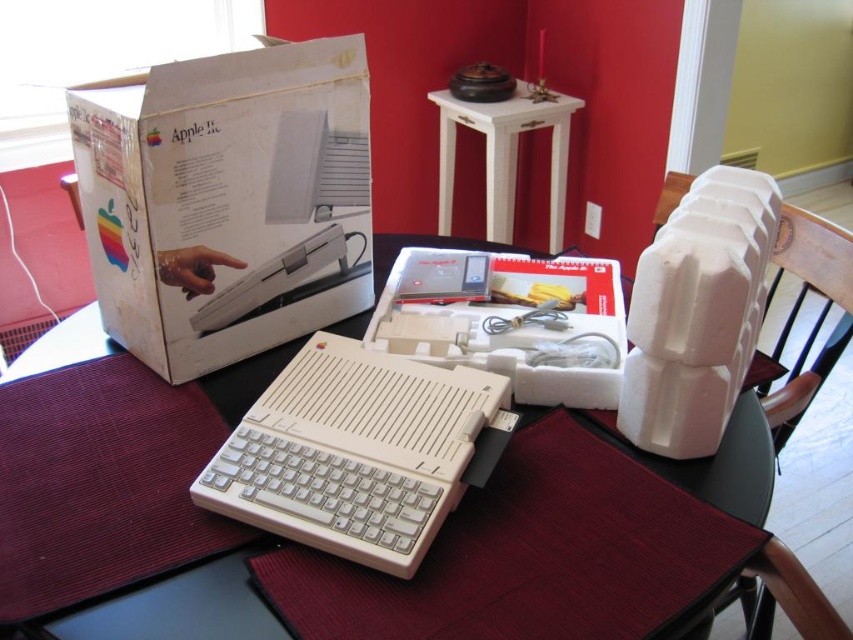
Question: From the image, what is the correct spatial relationship of white plastic computer at center in relation to white foam chair at right?

Choices:
 (A) left
 (B) right

Answer: (A)

Question: Can you confirm if white plastic computer at center is positioned to the left of white wood table at upper center?

Choices:
 (A) no
 (B) yes

Answer: (B)

Question: Among these objects, which one is farthest from the camera?

Choices:
 (A) white plastic computer at center
 (B) white cardboard box at upper left
 (C) white wood table at upper center

Answer: (C)

Question: Which object is the farthest from the white cardboard box at upper left?

Choices:
 (A) white plastic table at center
 (B) white wood table at upper center

Answer: (B)

Question: Which object is closer to the camera taking this photo?

Choices:
 (A) white plastic computer at center
 (B) white foam chair at right

Answer: (A)

Question: Observing the image, what is the correct spatial positioning of white plastic table at center in reference to white foam chair at right?

Choices:
 (A) left
 (B) right

Answer: (A)